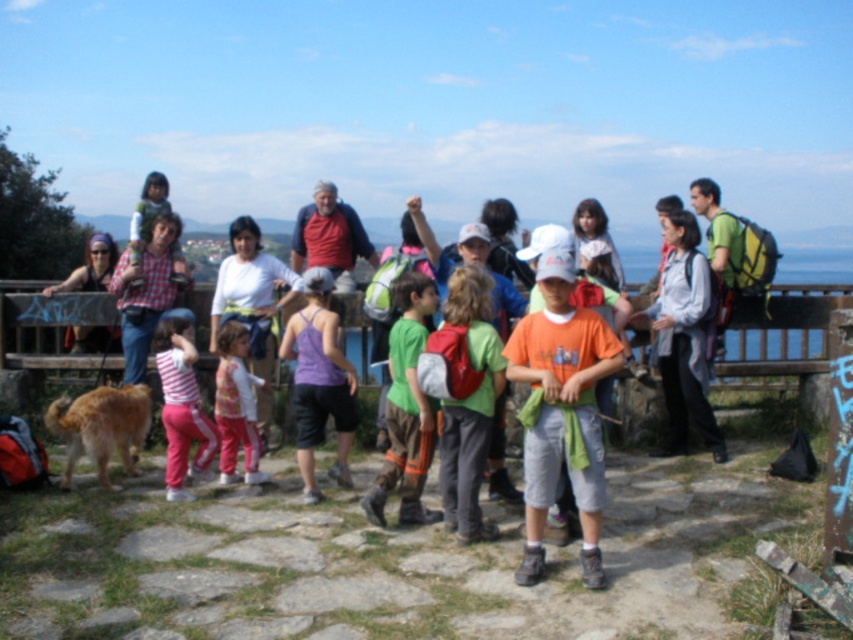
You are a photographer trying to capture a photo of the light gray fabric jacket at center and the pink fabric pants at center. Since you want to ensure both are visible in the photo, which clothing item should you focus on to make sure the one in front is sharp?

You should focus on the light gray fabric jacket at center because the pink fabric pants at center is behind it, so ensuring the jacket is sharp will help both appear clear in the photo.

You are a photographer trying to capture a group photo of the orange cotton shirt at center and the striped cotton shirt at center. The camera frame can only accommodate objects up to 1.2 meters in width. Based on their positions, will both individuals wearing these shirts fit within the frame?

The orange cotton shirt at center might be wider than striped cotton shirt at center, but since the exact width isn

You are standing at the scenic overlook and want to reach a specific spot marked by a point at coordinates point (x=686, y=403). If you can walk 3 meters per minute, how long will it take you to reach that point?

The point (x=686, y=403) is 7.28 meters away from you. At a walking speed of 3 meters per minute, it would take approximately 2.43 minutes to reach the point.